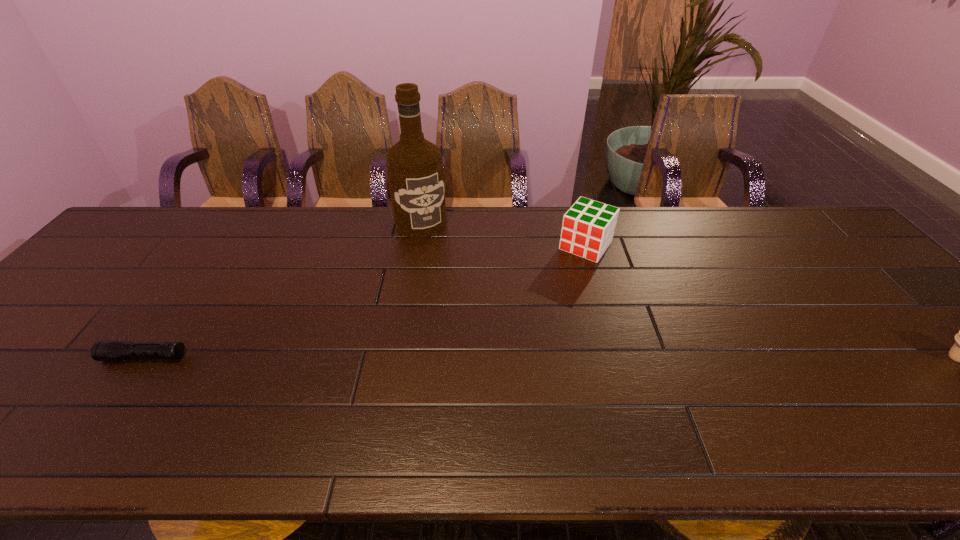
Identify the location of object that ranks as the third closest to the second object from left to right. The height and width of the screenshot is (540, 960). (959, 352).

Locate an element on the screen. The height and width of the screenshot is (540, 960). free space that satisfies the following two spatial constraints: 1. on the front side of the third object from left to right; 2. on the right side of the third object from right to left is located at coordinates (418, 246).